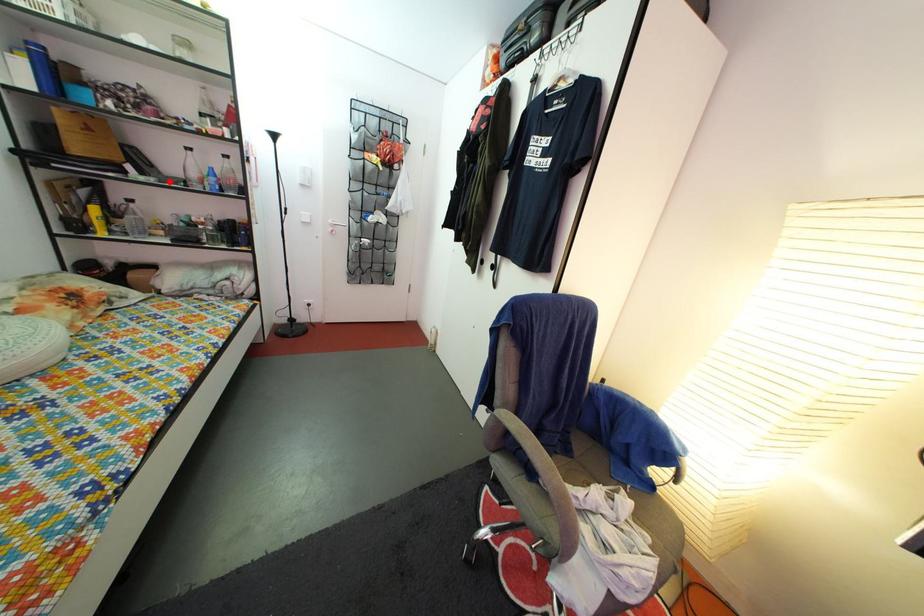
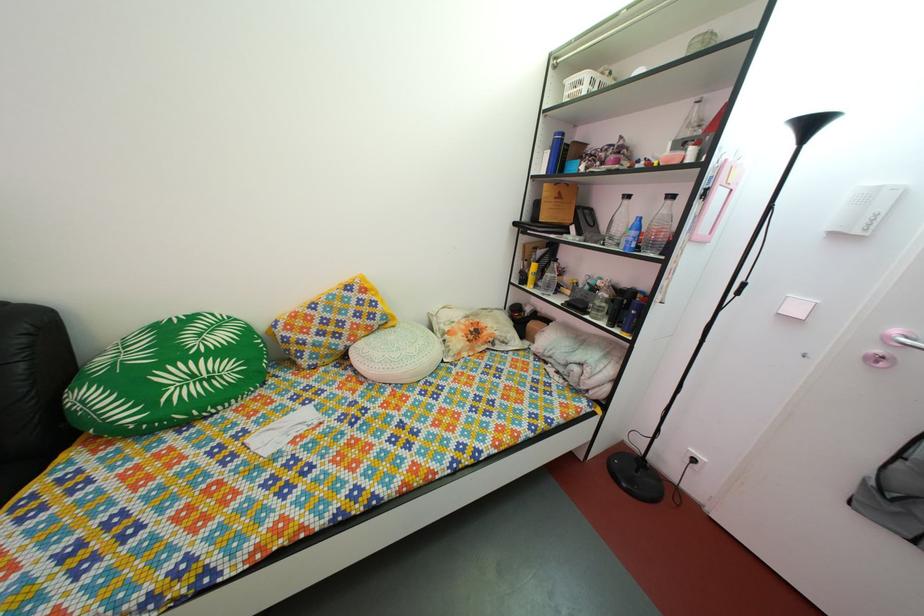
Find the pixel in the second image that matches the highlighted location in the first image.

(608, 241)